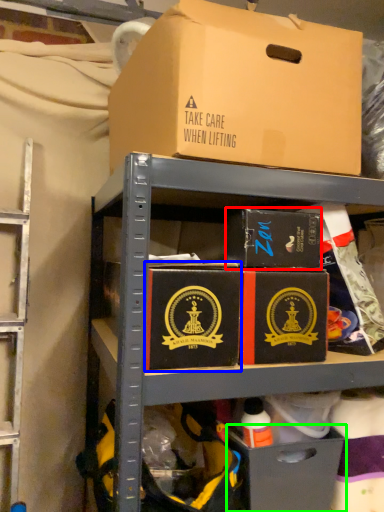
Question: Which object is the farthest from box (highlighted by a red box)? Choose among these: box (highlighted by a blue box) or drawer (highlighted by a green box).

Choices:
 (A) box
 (B) drawer

Answer: (B)